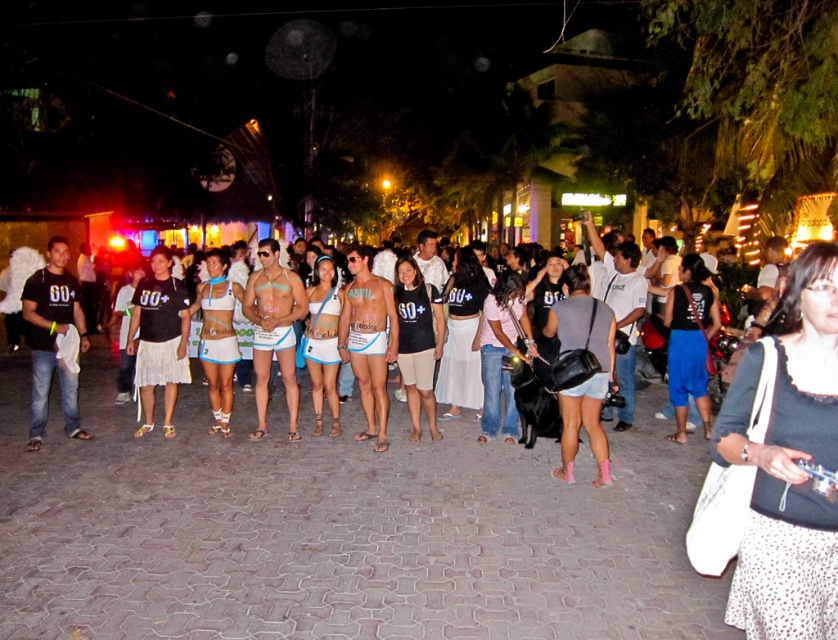
Question: Is pink fabric shirt at center wider than matte white bikini at center?

Choices:
 (A) no
 (B) yes

Answer: (A)

Question: Estimate the real-world distances between objects in this image. Which object is farther from the white dotted fabric at center?

Choices:
 (A) black cotton skirt at center
 (B) white fringed skirt at center
 (C) matte white bikini at center

Answer: (B)

Question: Based on their relative distances, which object is nearer to the black matte t-shirt at center?

Choices:
 (A) matte white bikini at center
 (B) white dotted fabric at lower right

Answer: (A)

Question: Among these objects, which one is nearest to the camera?

Choices:
 (A) white dotted fabric at lower right
 (B) white fringed skirt at center

Answer: (A)

Question: From the image, what is the correct spatial relationship of white fringed skirt at center in relation to pink fabric shirt at center?

Choices:
 (A) below
 (B) above

Answer: (B)

Question: Is white fringed skirt at center in front of black cotton skirt at center?

Choices:
 (A) yes
 (B) no

Answer: (A)